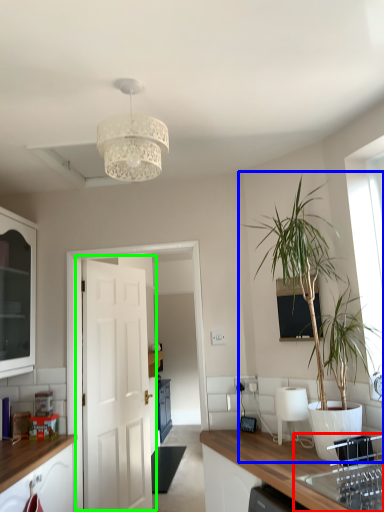
Question: Considering the real-world distances, which object is closest to sink (highlighted by a red box)? houseplant (highlighted by a blue box) or door (highlighted by a green box).

Choices:
 (A) houseplant
 (B) door

Answer: (A)